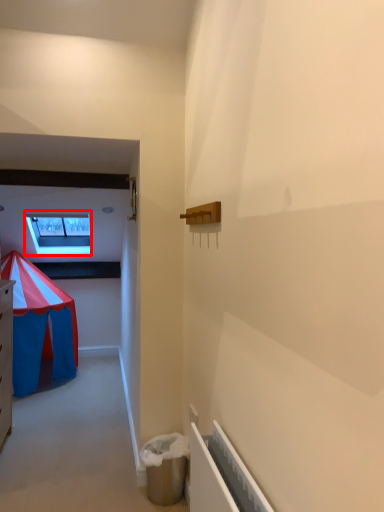
Question: From the image's perspective, where is window (annotated by the red box) located relative to radiator?

Choices:
 (A) below
 (B) above

Answer: (B)